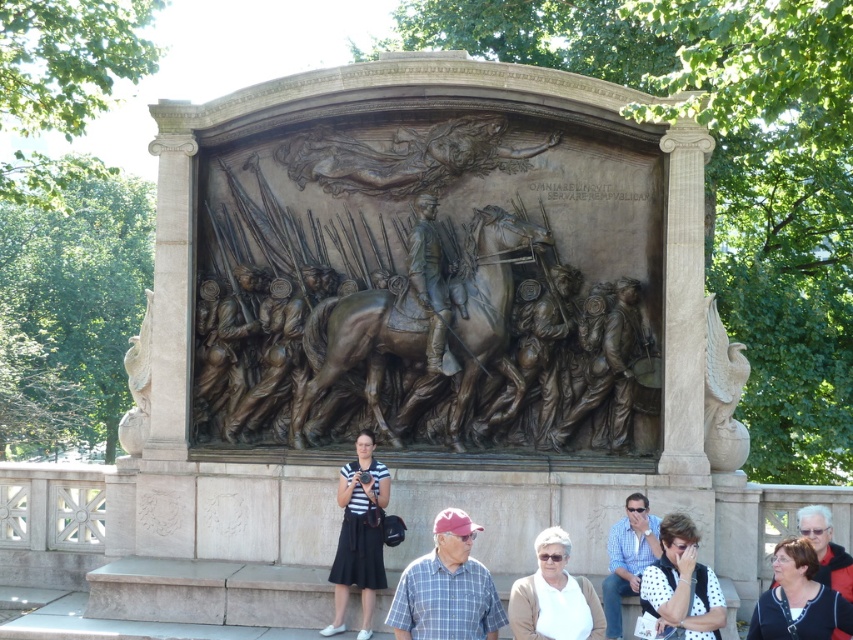
You are standing in front of the bronze relief sculpture and notice a small detail in the lower right corner. Can you determine the exact coordinates of the white dotted shirt at lower right?

The white dotted shirt at lower right is located at point (682, 582).

You are a tour guide pointing out details of the bronze relief sculpture to visitors. You mention the white dotted shirt at lower right and the matte black jacket at lower right. Which one is positioned more to the right side of the sculpture?

The matte black jacket at lower right is positioned more to the right side of the sculpture because the white dotted shirt at lower right is to the left of it.

You are an artist examining the bronze relief sculpture. You notice two figures in the scene wearing a plaid shirt at center and a matte black jacket at lower right. Which figure is more prominent in size?

The plaid shirt at center is bigger than the matte black jacket at lower right, so the figure wearing the plaid shirt at center is more prominent in size.